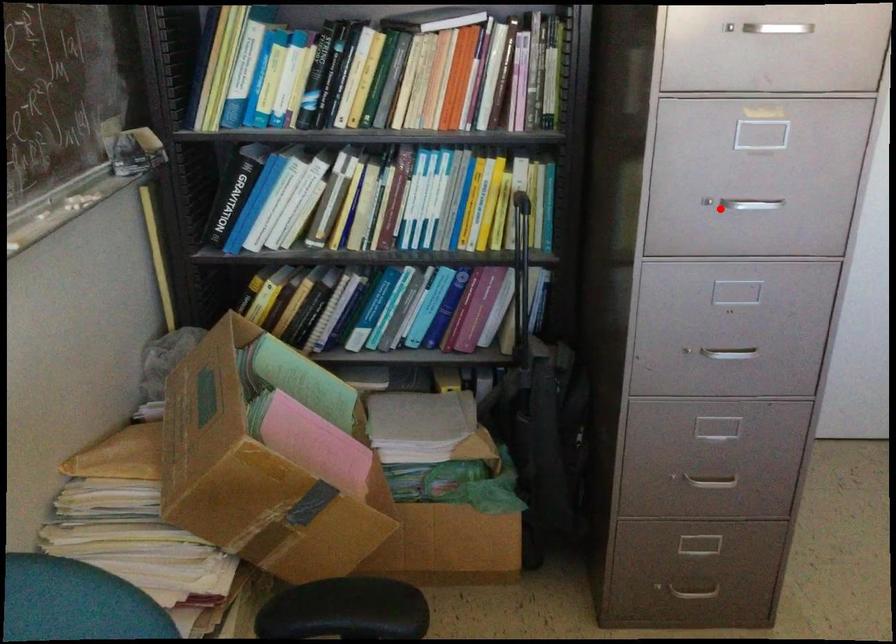
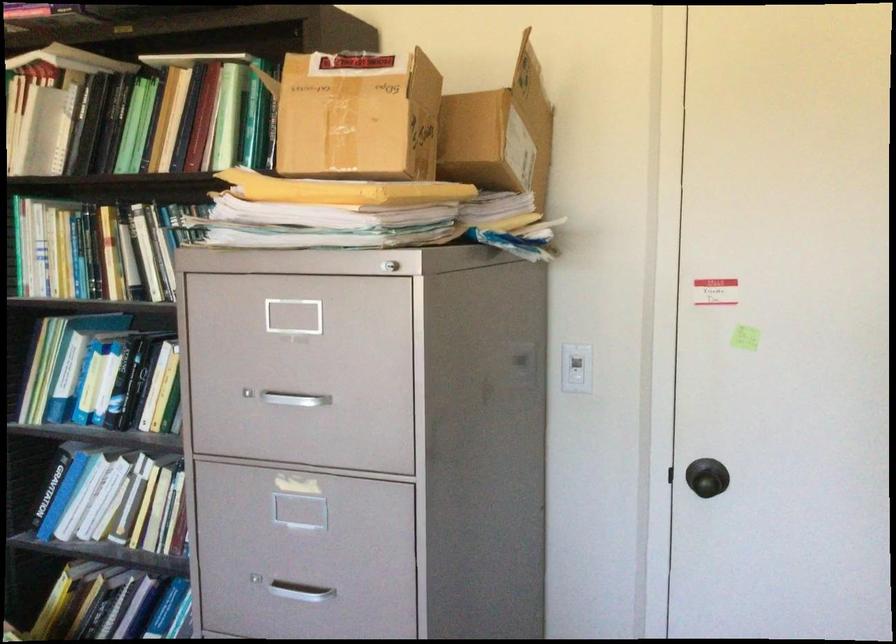
Where in the second image is the point corresponding to the highlighted location from the first image?

(300, 592)